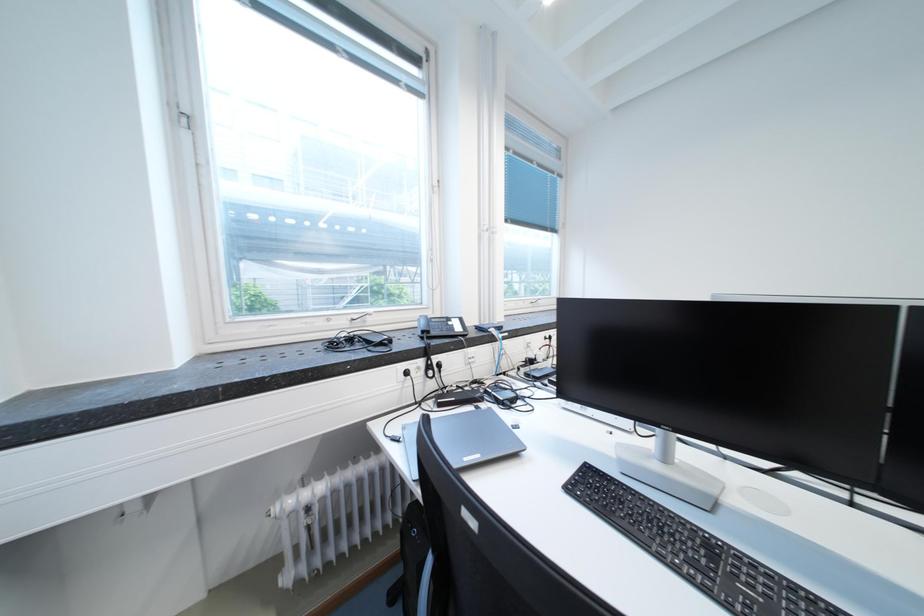
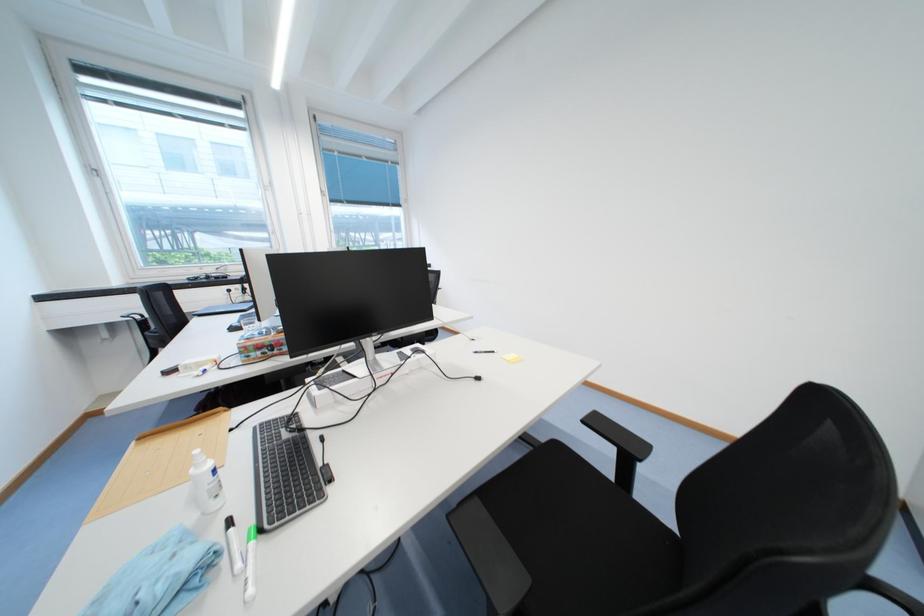
The images are taken continuously from a first-person perspective. In which direction are you moving?

The cameraman moved toward right, backward.